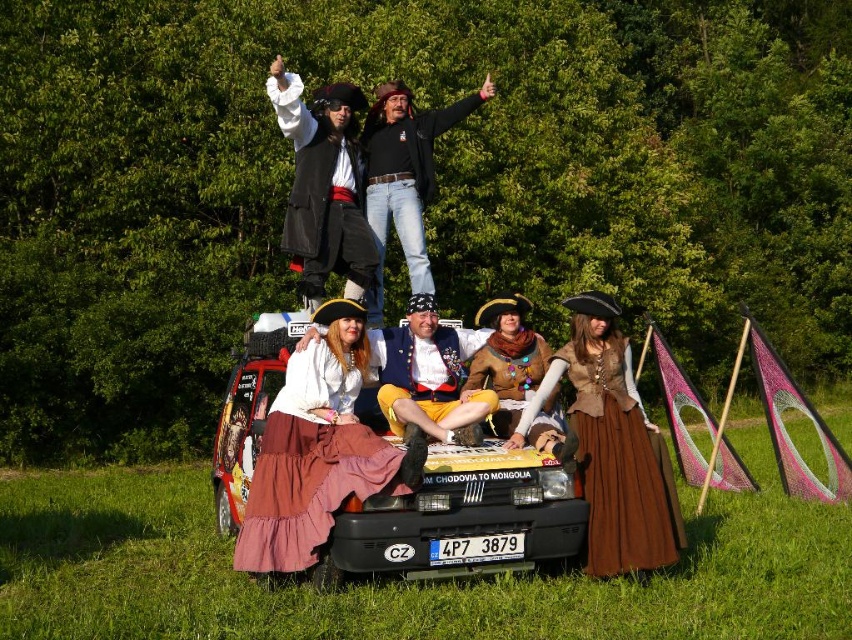
How distant is matte black coat at upper center from velvet yellow pants at center?

matte black coat at upper center is 4.18 feet from velvet yellow pants at center.

Can you confirm if matte black coat at upper center is taller than velvet yellow pants at center?

Yes, matte black coat at upper center is taller than velvet yellow pants at center.

Who is more forward, (298,118) or (396,429)?

Positioned in front is point (396,429).

Where is `matte black coat at upper center`? The image size is (852, 640). matte black coat at upper center is located at coordinates point(323,186).

Who is higher up, matte black car at center or leather jacket at center?

leather jacket at center is above.

The image size is (852, 640). I want to click on matte black car at center, so pyautogui.click(x=458, y=515).

Does point (668, 500) come in front of point (542, 413)?

Yes, point (668, 500) is in front of point (542, 413).

Is point (611, 531) more distant than point (492, 376)?

No, (611, 531) is in front of (492, 376).

The width and height of the screenshot is (852, 640). Find the location of `brown leather vest at center`. brown leather vest at center is located at coordinates (611, 445).